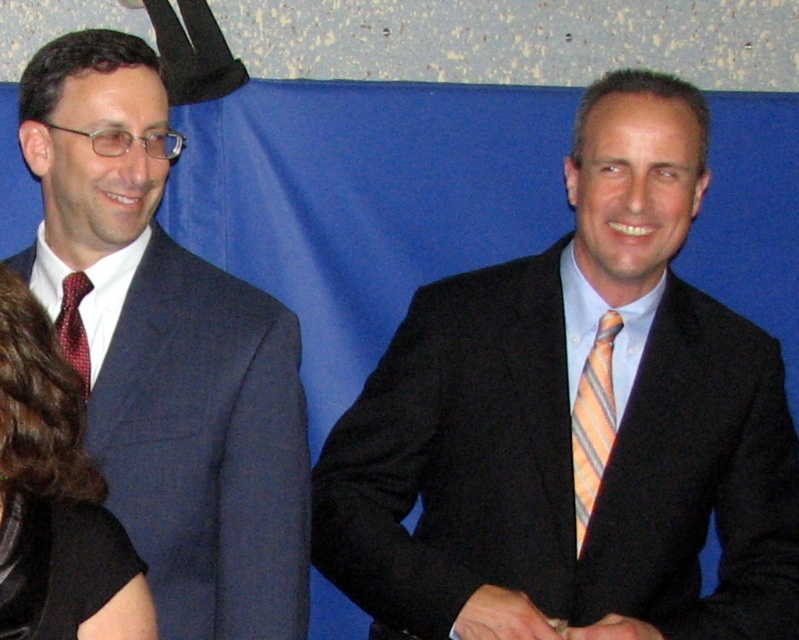
Question: Does shiny black hair at left lie behind red dotted silk tie at left?

Choices:
 (A) no
 (B) yes

Answer: (A)

Question: Can you confirm if matte black suit at center is wider than red dotted silk tie at left?

Choices:
 (A) no
 (B) yes

Answer: (B)

Question: Which point is closer to the camera?

Choices:
 (A) shiny black hair at left
 (B) matte black suit at center

Answer: (A)

Question: Is matte black suit at center to the left of shiny black hair at left from the viewer's perspective?

Choices:
 (A) yes
 (B) no

Answer: (B)

Question: Which object is positioned closest to the shiny black hair at left?

Choices:
 (A) matte black suit at left
 (B) orange striped tie at right
 (C) red dotted silk tie at left

Answer: (A)

Question: Which of the following is the farthest from the observer?

Choices:
 (A) (650, 104)
 (B) (92, 60)
 (C) (81, 326)

Answer: (C)